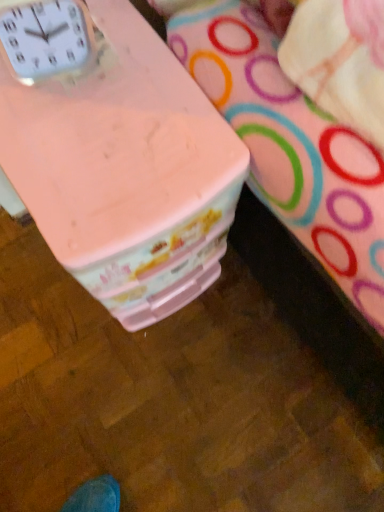
Find the location of a particular element. The width and height of the screenshot is (384, 512). vacant area on top of pink plastic container at center (from a real-world perspective) is located at coordinates (94, 115).